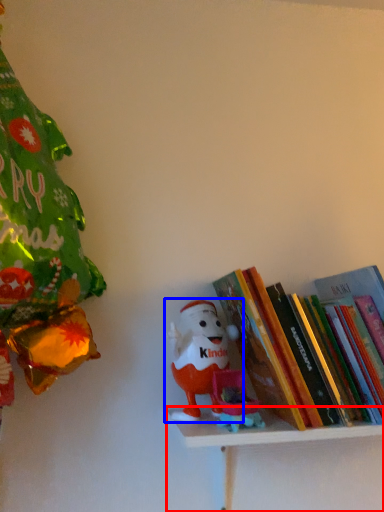
Question: Which object is closer to the camera taking this photo, shelf (highlighted by a red box) or toy (highlighted by a blue box)?

Choices:
 (A) shelf
 (B) toy

Answer: (A)